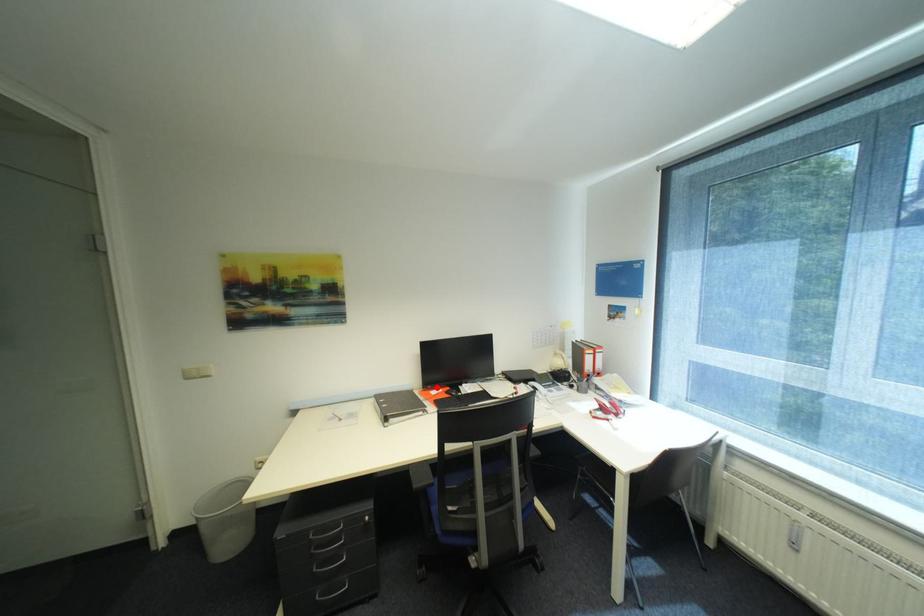
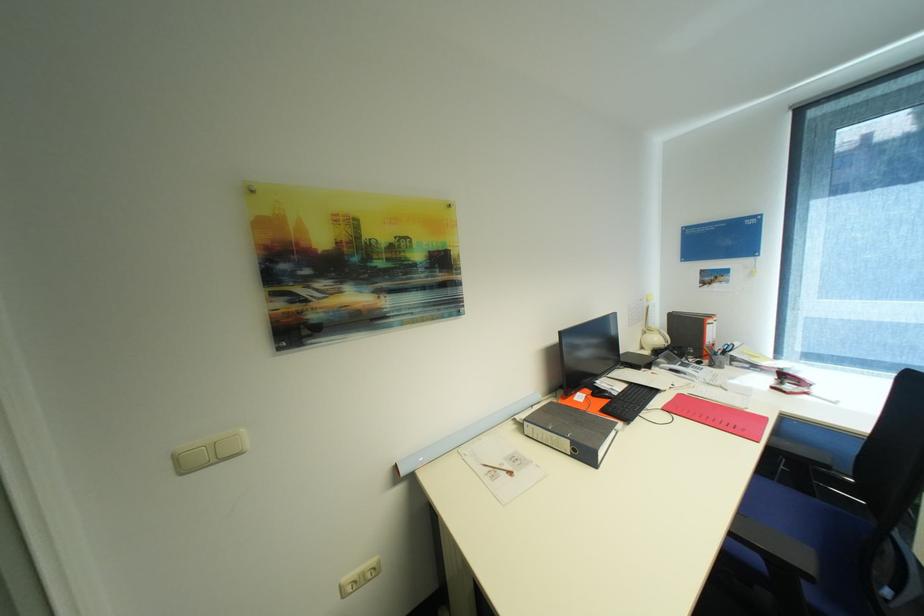
Find the pixel in the second image that matches the highlighted location in the first image.

(581, 392)